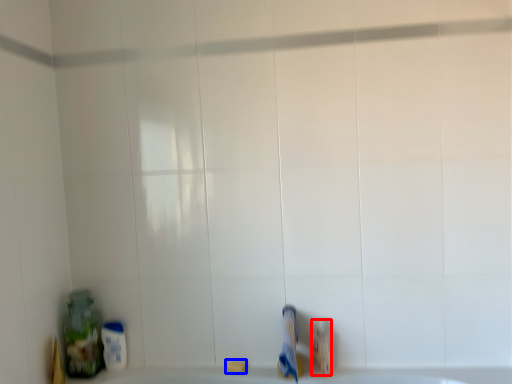
Question: Which of the following is the farthest to the observer, toiletry (highlighted by a red box) or soap (highlighted by a blue box)?

Choices:
 (A) toiletry
 (B) soap

Answer: (B)